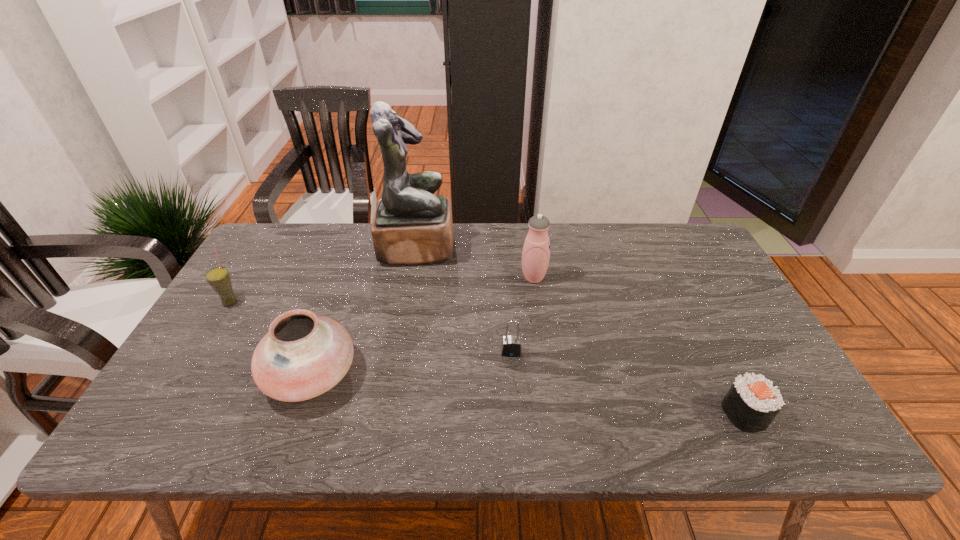
You are a GUI agent. You are given a task and a screenshot of the screen. Output one action in this format:
    pyautogui.click(x=<x>, y=<y>)
    Task: Click on the free space between the pottery and the rightmost object
    The width and height of the screenshot is (960, 540).
    Given the screenshot: What is the action you would take?
    pyautogui.click(x=528, y=394)

This screenshot has height=540, width=960. I want to click on free space between the pottery and the second farthest object, so click(x=422, y=326).

The image size is (960, 540). Find the location of `unoccupied area between the padlock and the third farthest object`. unoccupied area between the padlock and the third farthest object is located at coordinates (371, 327).

Locate an element on the screen. Image resolution: width=960 pixels, height=540 pixels. free spot between the padlock and the leftmost object is located at coordinates (371, 327).

Image resolution: width=960 pixels, height=540 pixels. I want to click on vacant space in between the second tallest object and the tallest object, so click(x=475, y=262).

This screenshot has height=540, width=960. In order to click on vacant area between the pottery and the second tallest object in this screenshot , I will do `click(422, 326)`.

Find the location of `unoccupied area between the fourth nearest object and the tallest object`. unoccupied area between the fourth nearest object and the tallest object is located at coordinates click(324, 274).

You are a GUI agent. You are given a task and a screenshot of the screen. Output one action in this format:
    pyautogui.click(x=<x>, y=<y>)
    Task: Click on the object that stands as the third closest to the pottery
    
    Given the screenshot: What is the action you would take?
    pyautogui.click(x=511, y=345)

Where is `object that ranks as the second closest to the thermos bottle`? This screenshot has width=960, height=540. object that ranks as the second closest to the thermos bottle is located at coordinates (511, 345).

Locate an element on the screen. free space that satisfies the following two spatial constraints: 1. in a relaxed pose on the second object from right to left; 2. on the left side of the sculpture is located at coordinates (412, 278).